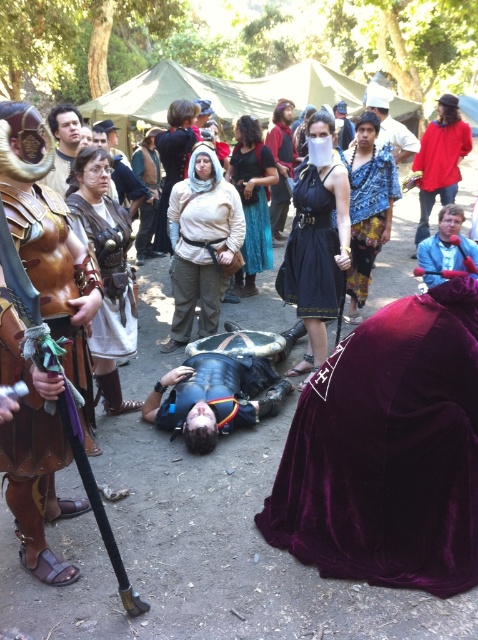
Question: Which object is farther from the camera taking this photo?

Choices:
 (A) white cotton shirt at center
 (B) velvet skirt at center
 (C) velvet maroon cape at lower right

Answer: (B)

Question: Where is leather armor at left located in relation to blue fabric jacket at upper right in the image?

Choices:
 (A) below
 (B) above

Answer: (A)

Question: Which object is positioned farthest from the velvet skirt at center?

Choices:
 (A) red cotton shirt at upper right
 (B) leather armor at center

Answer: (B)

Question: Which point is farther to the camera?

Choices:
 (A) blue printed fabric dress at center
 (B) red cotton shirt at upper right

Answer: (B)

Question: Does red cotton shirt at upper right have a smaller size compared to velvet skirt at center?

Choices:
 (A) no
 (B) yes

Answer: (A)

Question: Does blue printed fabric dress at center have a larger size compared to velvet skirt at center?

Choices:
 (A) yes
 (B) no

Answer: (A)